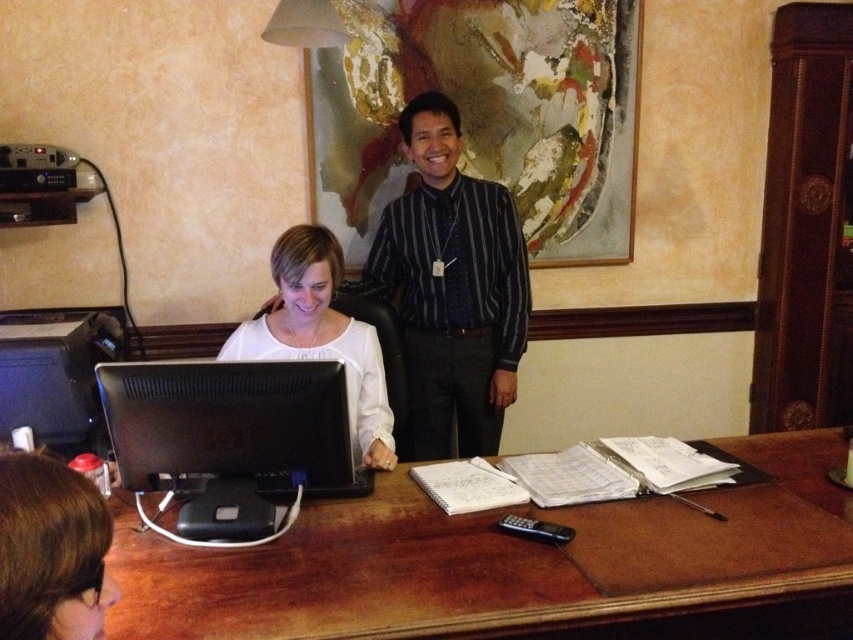
You are an office worker who needs to place a new white matte shirt at center on the desk. The desk has limited space. Based on the image, can the black glossy monitor at center be moved to the left to make space for the new shirt?

The black glossy monitor at center might be wider than the white matte shirt at center, so moving it to the left may not provide enough space if the monitor occupies more width than the shirt.

You are standing in the office scene described. There is a point marked at coordinates (517,564). Based on the scene, what object does this point most likely correspond to?

The point at coordinates (517,564) corresponds to the brown wooden table at center.